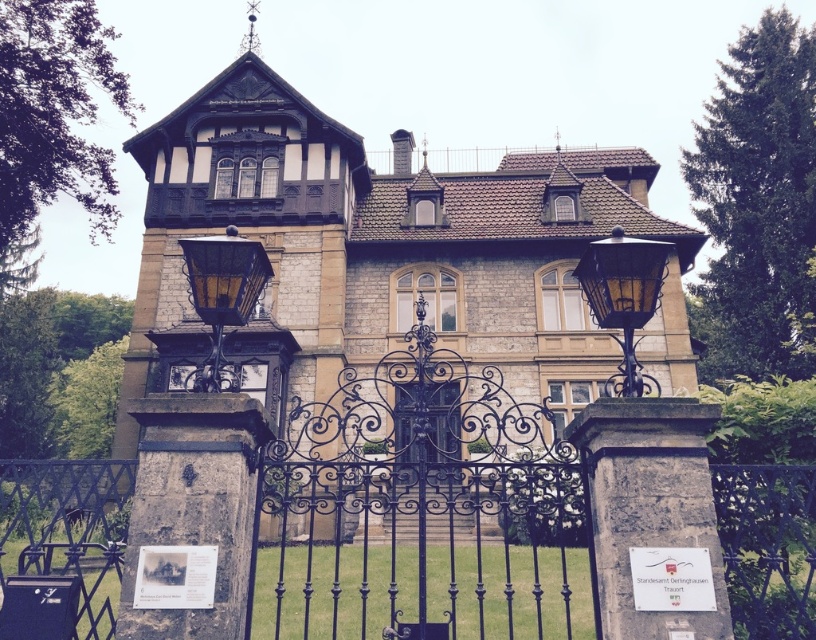
You are standing in front of the historic building and want to enter through the entrance. Which object should you approach first, the stone mansion at center or the black wrought iron gate at center?

You should approach the black wrought iron gate at center first because the stone mansion at center is positioned over it, meaning the gate is at the entrance level and the mansion is further back.

You are standing in front of the historic building and notice two points marked on its facade. The first point is at coordinate (593, 269) and the second at (408, 403). Which point is closer to you as you face the building?

Point (593, 269) is in front of point (408, 403), so it is closer to you as you face the building.